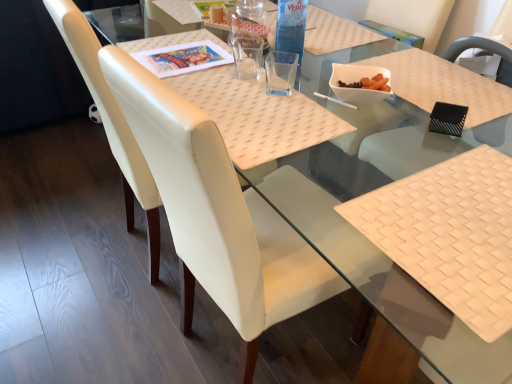
The image size is (512, 384). Identify the location of white woven placemat at lower right. (450, 234).

This screenshot has width=512, height=384. What do you see at coordinates (431, 110) in the screenshot?
I see `black mesh chair at upper right, marked as the first chair in a right-to-left arrangement` at bounding box center [431, 110].

The height and width of the screenshot is (384, 512). I want to click on black mesh chair at upper right, marked as the first chair in a right-to-left arrangement, so click(x=431, y=110).

What is the approximate width of white leather chair at center, which ranks as the second chair in left-to-right order?

white leather chair at center, which ranks as the second chair in left-to-right order, is 23.23 inches in width.

Locate an element on the screen. This screenshot has width=512, height=384. white woven placemat at lower right is located at coordinates (450, 234).

Who is bigger, white glossy bowl at center or transparent plastic bottle at upper center?

transparent plastic bottle at upper center is bigger.

Visually, is white glossy bowl at center positioned to the left or to the right of transparent plastic bottle at upper center?

In the image, white glossy bowl at center appears on the right side of transparent plastic bottle at upper center.

Which object is thinner, white glossy bowl at center or transparent plastic bottle at upper center?

transparent plastic bottle at upper center is thinner.

Which of these two, white glossy bowl at center or transparent plastic bottle at upper center, stands shorter?

Standing shorter between the two is white glossy bowl at center.

Between black mesh chair at upper right, marked as the first chair in a right-to-left arrangement, and white leather chair at center, which ranks as the second chair in left-to-right order, which one has more height?

Standing taller between the two is white leather chair at center, which ranks as the second chair in left-to-right order.

Does point (426, 61) lie behind point (243, 335)?

Yes, it is behind point (243, 335).

From the image's perspective, is black mesh chair at upper right, marked as the first chair in a right-to-left arrangement, positioned above or below white leather chair at center, which ranks as the second chair in left-to-right order?

Based on their image positions, black mesh chair at upper right, marked as the first chair in a right-to-left arrangement, is located above white leather chair at center, which ranks as the second chair in left-to-right order.

Which is more to the right, black mesh chair at upper right, marked as the first chair in a right-to-left arrangement, or white leather chair at center, acting as the 2th chair starting from the right?

black mesh chair at upper right, marked as the first chair in a right-to-left arrangement, is more to the right.

Which is in front, point (438, 209) or point (294, 17)?

The point (438, 209) is more forward.

Which is more to the left, white woven placemat at lower right or transparent plastic bottle at upper center?

From the viewer's perspective, transparent plastic bottle at upper center appears more on the left side.

Is white woven placemat at lower right far away from transparent plastic bottle at upper center?

white woven placemat at lower right is actually quite close to transparent plastic bottle at upper center.

From the image's perspective, would you say white leather chair at left, which is the 3th chair in right-to-left order, is positioned over white leather chair at center, which ranks as the second chair in left-to-right order?

Correct, white leather chair at left, which is the 3th chair in right-to-left order, appears higher than white leather chair at center, which ranks as the second chair in left-to-right order, in the image.

Locate an element on the screen. This screenshot has width=512, height=384. chair that is the 1st one above the white leather chair at center, acting as the 2th chair starting from the right (from a real-world perspective) is located at coordinates (112, 124).

Is white leather chair at left, which is the 3th chair in right-to-left order, positioned far away from white leather chair at center, which ranks as the second chair in left-to-right order?

white leather chair at left, which is the 3th chair in right-to-left order, is near white leather chair at center, which ranks as the second chair in left-to-right order, not far away.

Which of these two, white leather chair at left, which is the 3th chair in right-to-left order, or white leather chair at center, acting as the 2th chair starting from the right, is wider?

Wider between the two is white leather chair at center, acting as the 2th chair starting from the right.

Does white leather chair at left, positioned as the 1th chair in left-to-right order, appear on the right side of black mesh chair at upper right, the 3th chair in the left-to-right sequence?

No.

From a real-world perspective, does white leather chair at left, positioned as the 1th chair in left-to-right order, stand above black mesh chair at upper right, the 3th chair in the left-to-right sequence?

No, from a real-world perspective, white leather chair at left, positioned as the 1th chair in left-to-right order, is not over black mesh chair at upper right, the 3th chair in the left-to-right sequence

Can you tell me how much white leather chair at left, positioned as the 1th chair in left-to-right order, and black mesh chair at upper right, the 3th chair in the left-to-right sequence, differ in facing direction?

They differ by 177 degrees in their facing directions.

Between white woven placemat at lower right and black mesh chair at upper right, the 3th chair in the left-to-right sequence, which one has larger width?

With larger width is black mesh chair at upper right, the 3th chair in the left-to-right sequence.

From a real-world perspective, who is located lower, white woven placemat at lower right or black mesh chair at upper right, marked as the first chair in a right-to-left arrangement?

white woven placemat at lower right is physically lower.

Looking at this image, do you think white woven placemat at lower right is within black mesh chair at upper right, marked as the first chair in a right-to-left arrangement, or outside of it?

white woven placemat at lower right is not enclosed by black mesh chair at upper right, marked as the first chair in a right-to-left arrangement.

Is white woven placemat at lower right turned away from black mesh chair at upper right, the 3th chair in the left-to-right sequence?

No.

Which point is more forward, (355, 81) or (417, 60)?

The point (355, 81) is in front.

Between white glossy bowl at center and black mesh chair at upper right, marked as the first chair in a right-to-left arrangement, which one appears on the left side from the viewer's perspective?

Positioned to the left is white glossy bowl at center.

Is white glossy bowl at center in front of or behind black mesh chair at upper right, the 3th chair in the left-to-right sequence, in the image?

Clearly, white glossy bowl at center is behind black mesh chair at upper right, the 3th chair in the left-to-right sequence.

Who is smaller, white glossy bowl at center or black mesh chair at upper right, marked as the first chair in a right-to-left arrangement?

white glossy bowl at center.

Where is `food located underneath the transparent plastic bottle at upper center (from a real-world perspective)`? food located underneath the transparent plastic bottle at upper center (from a real-world perspective) is located at coordinates (360, 83).

From the image's perspective, count 2nd chairs upward from the white leather chair at center, acting as the 2th chair starting from the right, and point to it. Please provide its 2D coordinates.

[(431, 110)]

Estimate the real-world distances between objects in this image. Which object is further from white leather chair at left, positioned as the 1th chair in left-to-right order, white glossy bowl at center or white leather chair at center, acting as the 2th chair starting from the right?

Based on the image, white glossy bowl at center appears to be further to white leather chair at left, positioned as the 1th chair in left-to-right order.

From the image, which object appears to be nearer to white glossy bowl at center, woven beige placemat at center or black mesh chair at upper right, the 3th chair in the left-to-right sequence?

black mesh chair at upper right, the 3th chair in the left-to-right sequence, is positioned closer to the anchor white glossy bowl at center.

Considering their positions, is white leather chair at center, acting as the 2th chair starting from the right, positioned further to black mesh chair at upper right, marked as the first chair in a right-to-left arrangement, than white glossy bowl at center?

Among the two, white leather chair at center, acting as the 2th chair starting from the right, is located further to black mesh chair at upper right, marked as the first chair in a right-to-left arrangement.

Estimate the real-world distances between objects in this image. Which object is further from white glossy bowl at center, woven beige placemat at center or transparent plastic bottle at upper center?

Based on the image, transparent plastic bottle at upper center appears to be further to white glossy bowl at center.

From the image, which object appears to be nearer to white glossy bowl at center, white woven placemat at lower right or white leather chair at center, which ranks as the second chair in left-to-right order?

white woven placemat at lower right is positioned closer to the anchor white glossy bowl at center.

From the picture: Considering their positions, is white woven placemat at lower right positioned closer to transparent plastic bottle at upper center than woven beige placemat at center?

The object closer to transparent plastic bottle at upper center is woven beige placemat at center.

Looking at this image, estimate the real-world distances between objects in this image. Which object is closer to white glossy bowl at center, white woven placemat at lower right or woven beige placemat at center?

The object closer to white glossy bowl at center is woven beige placemat at center.

Looking at the image, which one is located further to white glossy bowl at center, black mesh chair at upper right, marked as the first chair in a right-to-left arrangement, or transparent plastic bottle at upper center?

transparent plastic bottle at upper center is positioned further to the anchor white glossy bowl at center.

Locate an element on the screen. This screenshot has width=512, height=384. food between transparent plastic bottle at upper center and white woven placemat at lower right in the up-down direction is located at coordinates (360, 83).

Locate an element on the screen. The height and width of the screenshot is (384, 512). place mat positioned between white leather chair at center, acting as the 2th chair starting from the right, and black mesh chair at upper right, marked as the first chair in a right-to-left arrangement, from near to far is located at coordinates (450, 234).

The height and width of the screenshot is (384, 512). I want to click on place mat between woven beige placemat at center and black mesh chair at upper right, marked as the first chair in a right-to-left arrangement, from left to right, so click(450, 234).

Where is `food between transparent plastic bottle at upper center and white leather chair at center, acting as the 2th chair starting from the right, in the vertical direction`? food between transparent plastic bottle at upper center and white leather chair at center, acting as the 2th chair starting from the right, in the vertical direction is located at coordinates (360, 83).